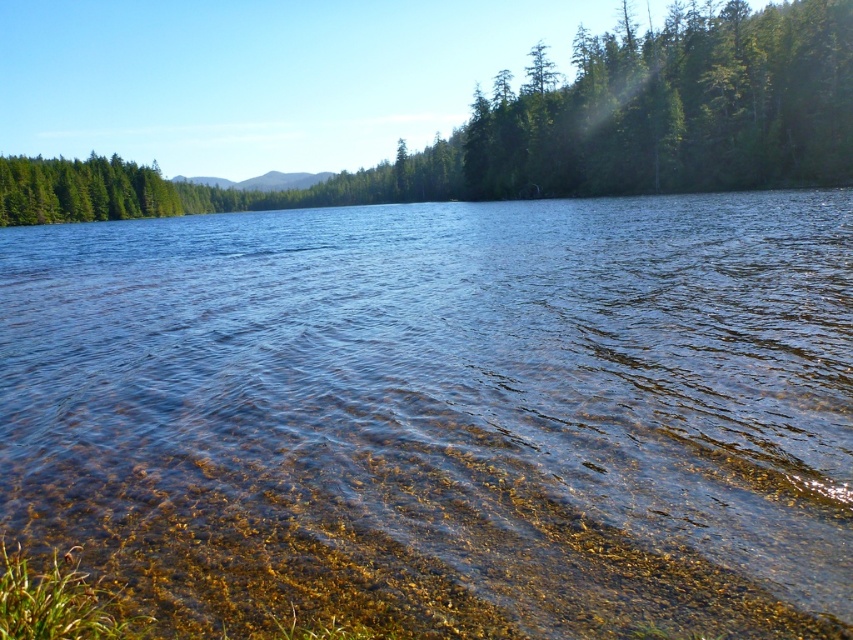
Where is `clear water at center`? The height and width of the screenshot is (640, 853). clear water at center is located at coordinates 445,412.

Is point (432, 588) closer to camera compared to point (786, 88)?

Yes, it is in front of point (786, 88).

Image resolution: width=853 pixels, height=640 pixels. In order to click on clear water at center in this screenshot , I will do `click(445, 412)`.

Locate an element on the screen. clear water at center is located at coordinates (445, 412).